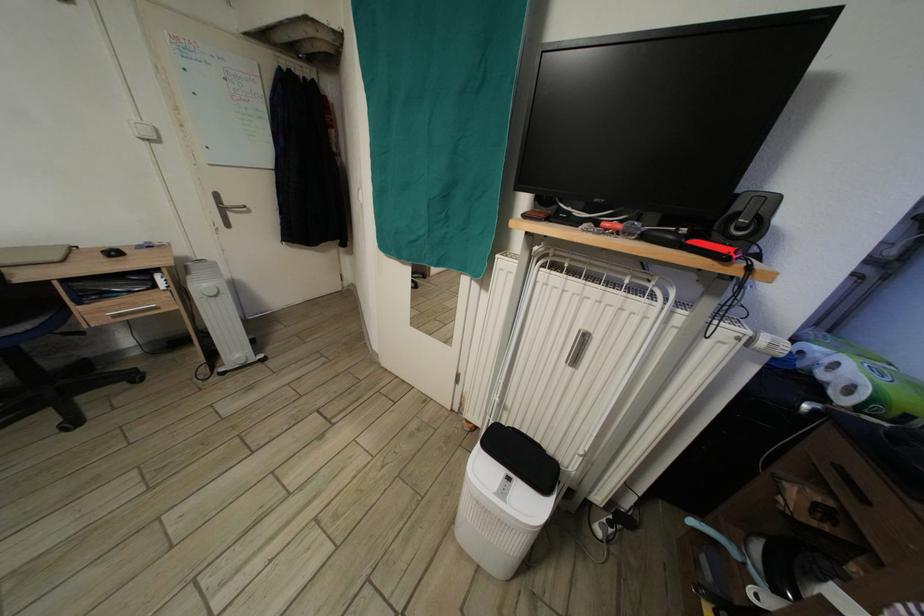
Where would you pull the silver drawer handle? Please return your answer as a coordinate pair (x, y).

(131, 310)